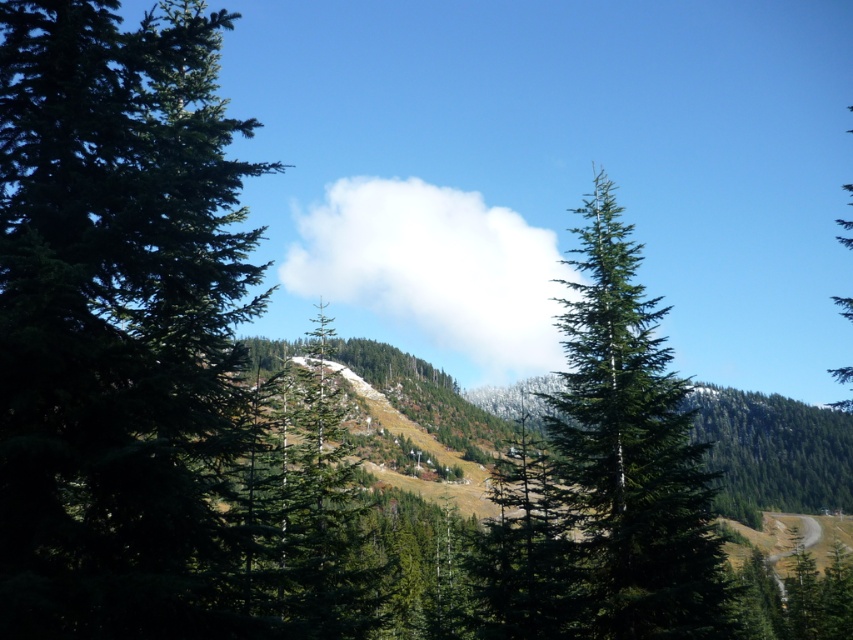
Between green matte tree at center and green matte tree at right, which one appears on the left side from the viewer's perspective?

green matte tree at center is more to the left.

Is point (628, 298) positioned before point (843, 220)?

Yes, point (628, 298) is in front of point (843, 220).

At what (x,y) coordinates should I click in order to perform the action: click on green matte tree at center. Please return your answer as a coordinate pair (x, y). Looking at the image, I should click on (607, 476).

Where is `green matte tree at center`? Image resolution: width=853 pixels, height=640 pixels. green matte tree at center is located at coordinates (607, 476).

Which of these two, white fluffy cloud at center or green matte tree at right, stands shorter?

Standing shorter between the two is white fluffy cloud at center.

Is point (554, 268) positioned behind point (851, 372)?

Yes, point (554, 268) is behind point (851, 372).

In order to click on white fluffy cloud at center in this screenshot , I will do `click(433, 269)`.

Does green matte tree at center appear under white fluffy cloud at center?

Yes.

Between green matte tree at center and white fluffy cloud at center, which one is positioned higher?

Positioned higher is white fluffy cloud at center.

Which is behind, point (683, 570) or point (454, 237)?

Positioned behind is point (454, 237).

The width and height of the screenshot is (853, 640). Find the location of `green matte tree at center`. green matte tree at center is located at coordinates (607, 476).